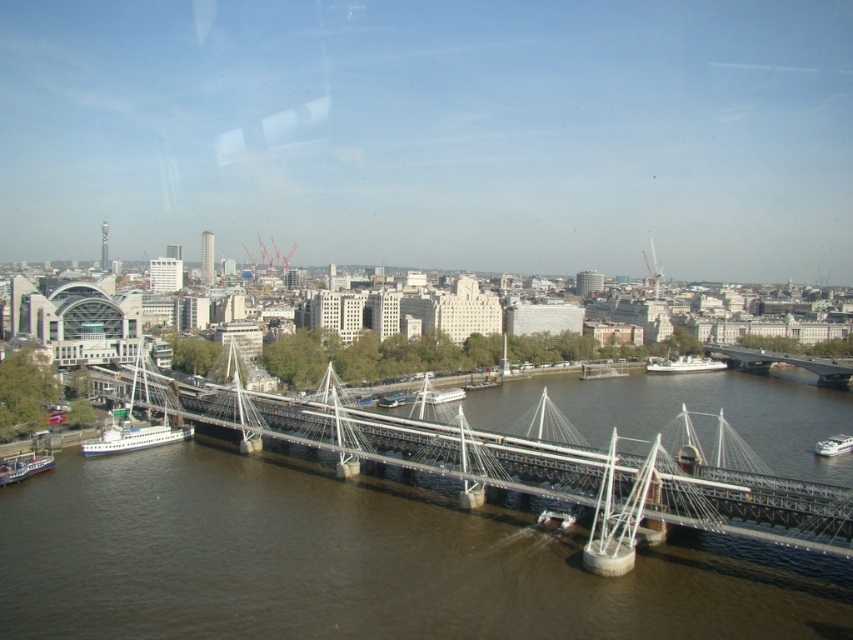
Is point (142, 433) in front of point (817, 451)?

Yes, point (142, 433) is in front of point (817, 451).

Which is above, green metallic boat at lower left or white glossy boat at lower right?

green metallic boat at lower left

Find the location of `green metallic boat at lower left`. green metallic boat at lower left is located at coordinates (134, 436).

Does white glossy ferry at lower left appear under white glossy boat at lower right?

No, white glossy ferry at lower left is not below white glossy boat at lower right.

Between point (9, 481) and point (828, 449), which one is positioned in front?

Positioned in front is point (9, 481).

You are a GUI agent. You are given a task and a screenshot of the screen. Output one action in this format:
    pyautogui.click(x=<x>, y=<y>)
    Task: Click on the white glossy ferry at lower left
    
    Given the screenshot: What is the action you would take?
    pyautogui.click(x=22, y=467)

Consider the image. Does metallic gray suspension bridge at center come behind metallic gray bridge at center?

No.

Is point (698, 506) positioned before point (822, 371)?

Yes, point (698, 506) is closer to viewer.

Is point (695, 488) behind point (718, 348)?

No, it is not.

Locate an element on the screen. This screenshot has height=640, width=853. metallic gray suspension bridge at center is located at coordinates (506, 460).